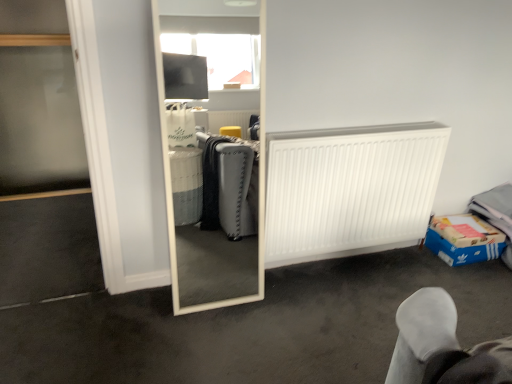
Question: Is white matte mirror at center located within blue cardboard box at lower right?

Choices:
 (A) yes
 (B) no

Answer: (B)

Question: Considering the relative sizes of blue cardboard box at lower right and white matte mirror at center in the image provided, is blue cardboard box at lower right smaller than white matte mirror at center?

Choices:
 (A) yes
 (B) no

Answer: (A)

Question: Is blue cardboard box at lower right in contact with white matte mirror at center?

Choices:
 (A) yes
 (B) no

Answer: (B)

Question: Considering the relative sizes of blue cardboard box at lower right and white matte mirror at center in the image provided, is blue cardboard box at lower right wider than white matte mirror at center?

Choices:
 (A) yes
 (B) no

Answer: (B)

Question: From the image's perspective, would you say blue cardboard box at lower right is shown under white matte mirror at center?

Choices:
 (A) yes
 (B) no

Answer: (B)

Question: Considering the relative positions of blue cardboard box at lower right and white matte mirror at center in the image provided, is blue cardboard box at lower right to the right of white matte mirror at center from the viewer's perspective?

Choices:
 (A) yes
 (B) no

Answer: (A)

Question: Is white matte radiator at center right facing away from white matte mirror at center?

Choices:
 (A) yes
 (B) no

Answer: (B)

Question: Does white matte radiator at center right come in front of white matte mirror at center?

Choices:
 (A) no
 (B) yes

Answer: (A)

Question: From the image's perspective, would you say white matte radiator at center right is positioned over white matte mirror at center?

Choices:
 (A) no
 (B) yes

Answer: (B)

Question: Can you confirm if white matte radiator at center right is taller than white matte mirror at center?

Choices:
 (A) yes
 (B) no

Answer: (A)

Question: Can you confirm if white matte radiator at center right is thinner than white matte mirror at center?

Choices:
 (A) no
 (B) yes

Answer: (B)

Question: Can you confirm if white matte radiator at center right is shorter than white matte mirror at center?

Choices:
 (A) no
 (B) yes

Answer: (A)

Question: Is white matte radiator at center right taller than blue cardboard box at lower right?

Choices:
 (A) no
 (B) yes

Answer: (B)